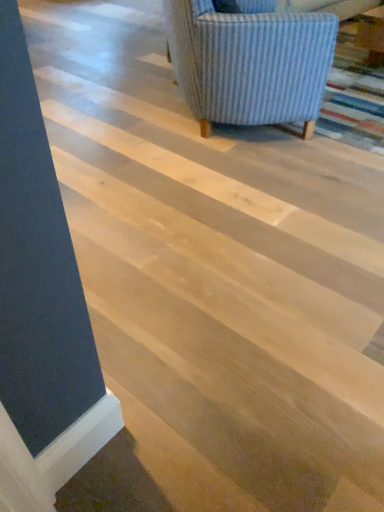
The image size is (384, 512). Find the location of `free space that is to the left of blue striped fabric chair at upper right`. free space that is to the left of blue striped fabric chair at upper right is located at coordinates (107, 105).